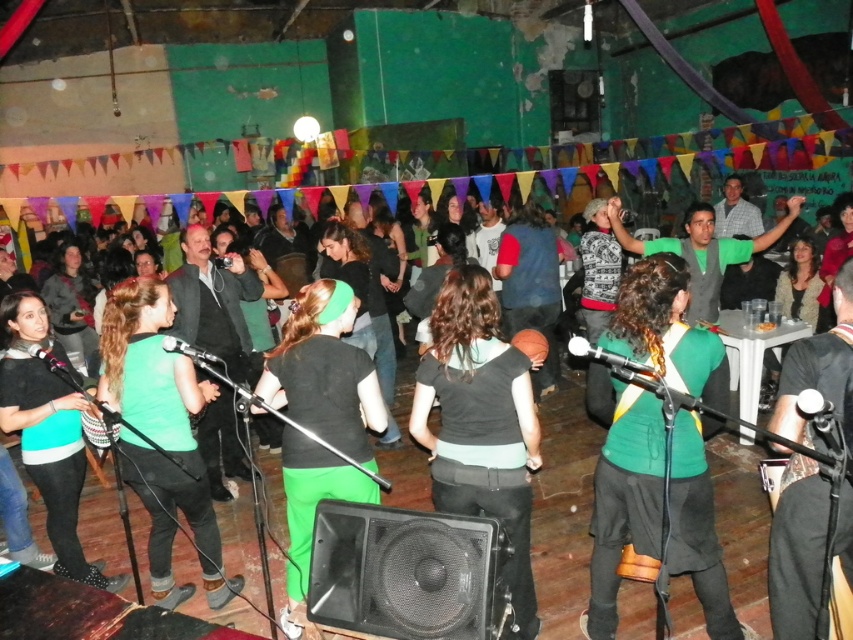
You are at a party and see two people wearing green matte shirt at center and black matte shirt at center. Which one is standing to the right side of the other?

The green matte shirt at center is to the right of the black matte shirt at center.